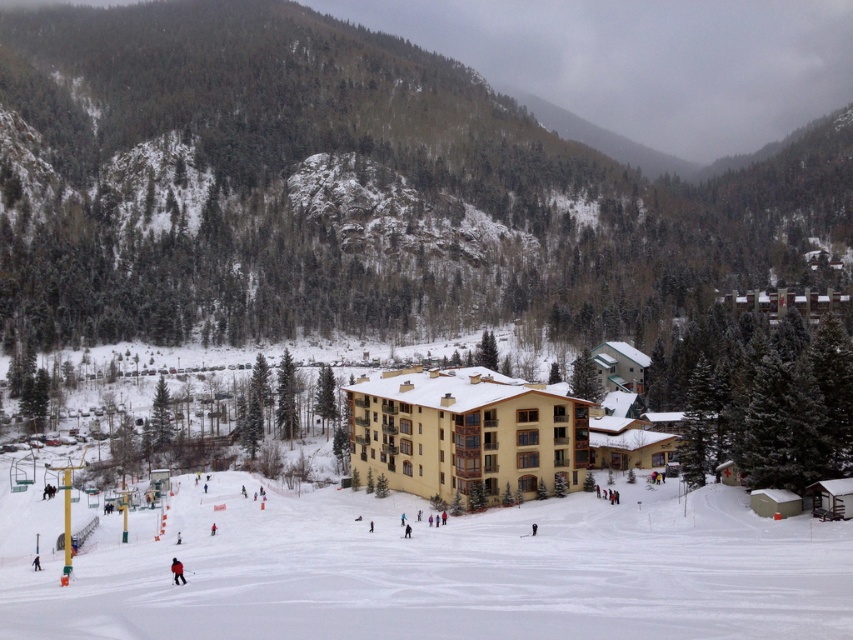
Can you confirm if yellow wood hotel at center is taller than red fabric jacket at lower center?

Yes, yellow wood hotel at center is taller than red fabric jacket at lower center.

Which of these two, yellow wood hotel at center or red fabric jacket at lower center, stands taller?

With more height is yellow wood hotel at center.

Which is in front, point (561, 401) or point (175, 579)?

Point (175, 579)

At what (x,y) coordinates should I click in order to perform the action: click on yellow wood hotel at center. Please return your answer as a coordinate pair (x, y). The height and width of the screenshot is (640, 853). Looking at the image, I should click on (463, 433).

Which is more to the right, white snow ski slope at lower center or red fabric jacket at lower center?

From the viewer's perspective, white snow ski slope at lower center appears more on the right side.

Can you confirm if white snow ski slope at lower center is positioned below red fabric jacket at lower center?

No, white snow ski slope at lower center is not below red fabric jacket at lower center.

Where is `white snow ski slope at lower center`? white snow ski slope at lower center is located at coordinates (448, 572).

At what (x,y) coordinates should I click in order to perform the action: click on white snow ski slope at lower center. Please return your answer as a coordinate pair (x, y). Image resolution: width=853 pixels, height=640 pixels. Looking at the image, I should click on (448, 572).